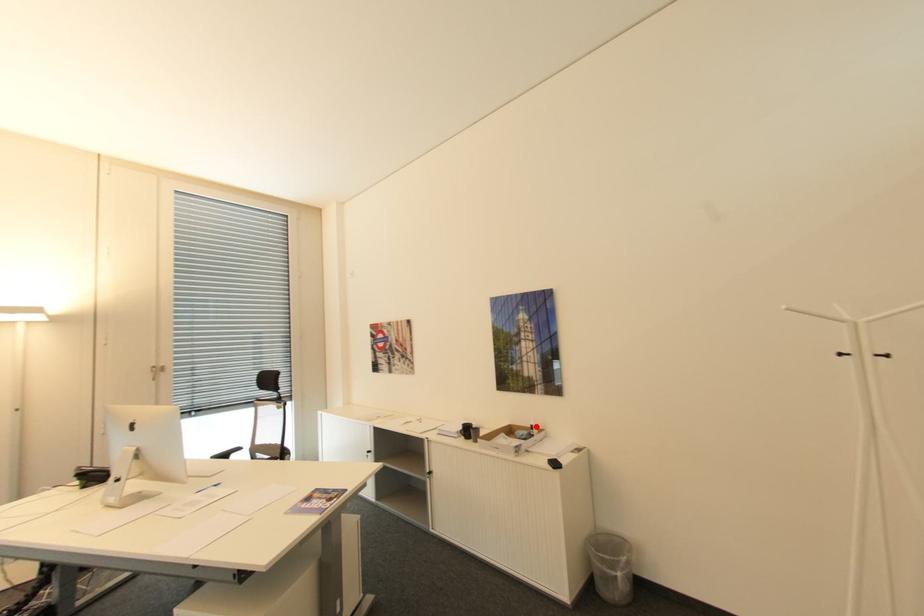
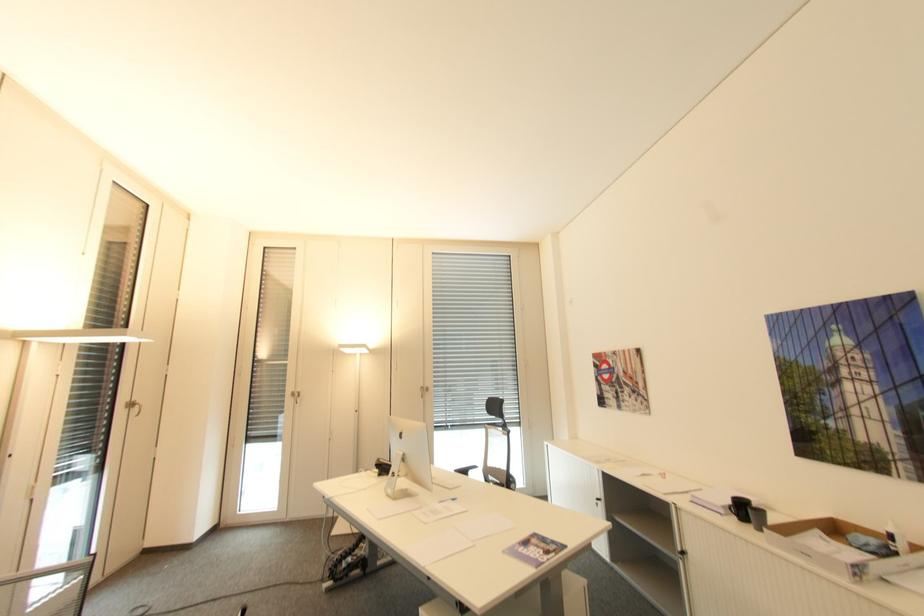
Question: I am providing you with two images of the same scene from different viewpoints. Given a red point in image1, look at the same physical point in image2. Is it:

Choices:
 (A) Closer to the viewpoint
 (B) Farther from the viewpoint

Answer: (A)